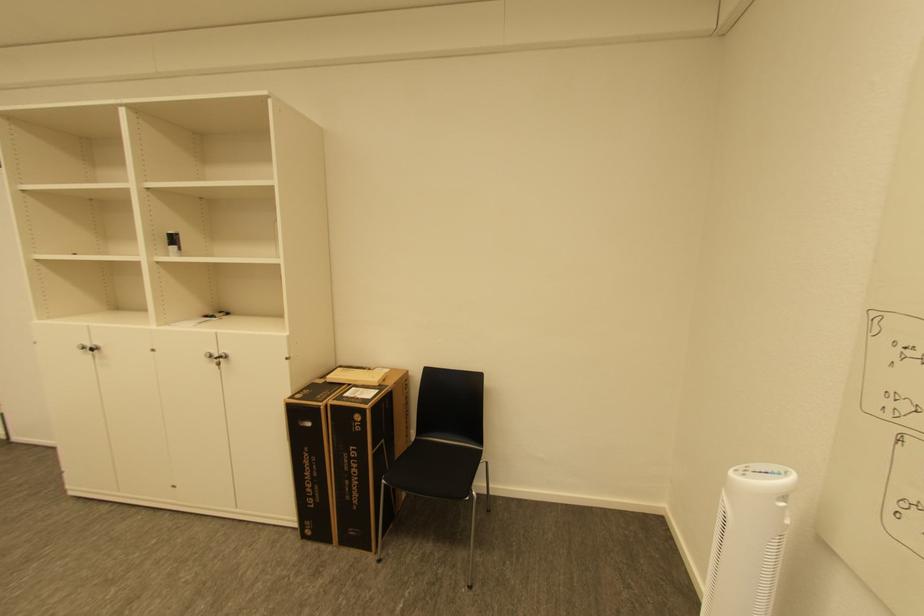
Locate an element on the screen. The image size is (924, 616). chair sitting surface is located at coordinates tap(438, 461).